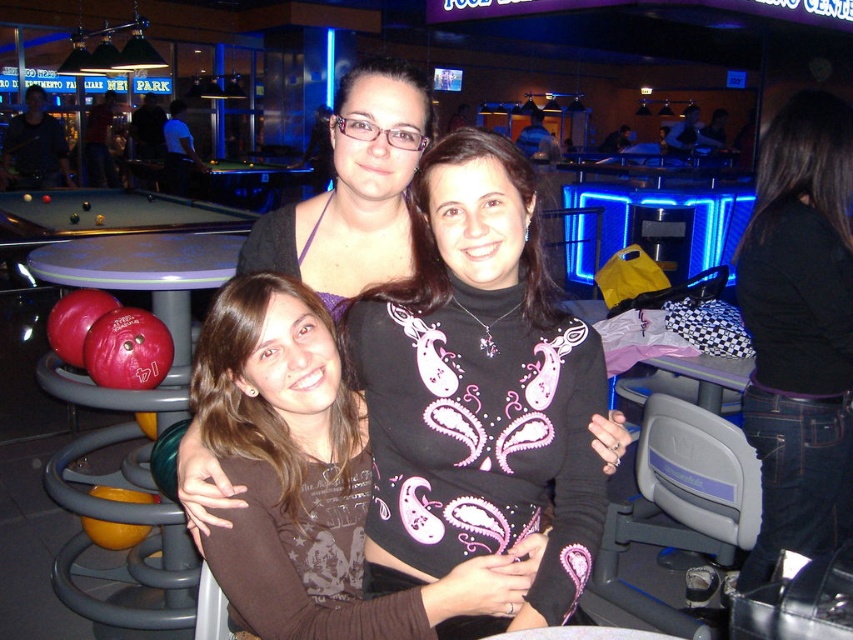
Question: Does brown fabric shirt at center appear over black denim jeans at lower right?

Choices:
 (A) yes
 (B) no

Answer: (B)

Question: Estimate the real-world distances between objects in this image. Which object is farther from the black denim jeans at lower right?

Choices:
 (A) brown fabric shirt at center
 (B) matte black top at center

Answer: (A)

Question: Which point is closer to the camera?

Choices:
 (A) (778, 248)
 (B) (259, 605)

Answer: (B)

Question: Which of these objects is positioned closest to the brown fabric shirt at center?

Choices:
 (A) matte black top at center
 (B) black denim jeans at lower right

Answer: (A)

Question: Does black denim jeans at lower right appear on the left side of matte black top at center?

Choices:
 (A) yes
 (B) no

Answer: (B)

Question: Is brown fabric shirt at center in front of black denim jeans at lower right?

Choices:
 (A) yes
 (B) no

Answer: (A)